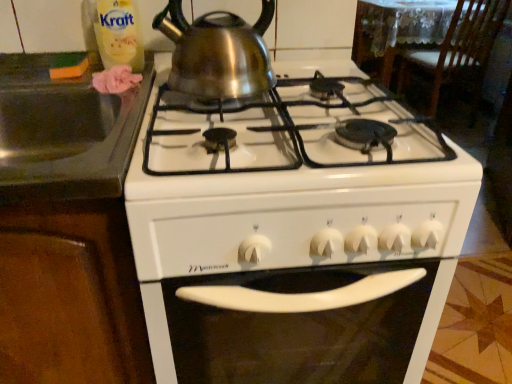
What do you see at coordinates (217, 52) in the screenshot?
I see `shiny metallic kettle at upper center` at bounding box center [217, 52].

I want to click on black granite sink at left, so click(64, 133).

Find the location of a particular element. The height and width of the screenshot is (384, 512). white glossy gas stove at center is located at coordinates (292, 243).

Is shiny metallic kettle at upper center at the back of white glossy gas stove at center?

No.

In the scene shown: From a real-world perspective, is white glossy gas stove at center located beneath shiny metallic kettle at upper center?

Yes.

Looking at this image, can you tell me how much white glossy gas stove at center and shiny metallic kettle at upper center differ in facing direction?

The angle between the facing direction of white glossy gas stove at center and the facing direction of shiny metallic kettle at upper center is 0.000343 degrees.

Which is closer, (216, 277) or (198, 86)?

The point (216, 277) is closer to the camera.

Between shiny metallic kettle at upper center and black granite sink at left, which one has smaller size?

shiny metallic kettle at upper center.

Is shiny metallic kettle at upper center situated inside black granite sink at left or outside?

shiny metallic kettle at upper center lies outside black granite sink at left.

Which is more to the right, shiny metallic kettle at upper center or black granite sink at left?

shiny metallic kettle at upper center.

Could you tell me if shiny metallic kettle at upper center is facing black granite sink at left?

No, shiny metallic kettle at upper center is not oriented towards black granite sink at left.

Looking at this image, could you tell me if wooden chair at upper right is turned towards translucent plastic bottle at upper left?

No.

From a real-world perspective, between wooden chair at upper right and translucent plastic bottle at upper left, who is vertically higher?

translucent plastic bottle at upper left is physically above.

From the image's perspective, does wooden chair at upper right appear higher than translucent plastic bottle at upper left?

Yes, from the image's perspective, wooden chair at upper right is above translucent plastic bottle at upper left.

How many degrees apart are the facing directions of wooden chair at upper right and white glossy gas stove at center?

They differ by 180 degrees in their facing directions.

Which object is more forward, wooden chair at upper right or white glossy gas stove at center?

white glossy gas stove at center is closer to the camera.

Identify the location of gas stove in front of the wooden chair at upper right. The image size is (512, 384). (292, 243).

Would you say wooden chair at upper right is a long distance from white glossy gas stove at center?

Indeed, wooden chair at upper right is not near white glossy gas stove at center.

From a real-world perspective, between black granite sink at left and translucent plastic bottle at upper left, who is vertically lower?

From a 3D spatial view, black granite sink at left is below.

Is black granite sink at left taller than translucent plastic bottle at upper left?

No.

From a real-world perspective, who is located higher, wooden chair at upper right or shiny metallic kettle at upper center?

From a 3D spatial view, shiny metallic kettle at upper center is above.

Consider the image. Which is more to the left, wooden chair at upper right or shiny metallic kettle at upper center?

From the viewer's perspective, shiny metallic kettle at upper center appears more on the left side.

Based on the photo, how different are the orientations of wooden chair at upper right and shiny metallic kettle at upper center in degrees?

There is a 180-degree angle between the facing directions of wooden chair at upper right and shiny metallic kettle at upper center.

Is wooden chair at upper right facing towards shiny metallic kettle at upper center?

No, wooden chair at upper right is not turned towards shiny metallic kettle at upper center.

Is white glossy gas stove at center bigger than wooden chair at upper right?

Yes.

Is white glossy gas stove at center inside the boundaries of wooden chair at upper right, or outside?

white glossy gas stove at center is outside wooden chair at upper right.

You are a GUI agent. You are given a task and a screenshot of the screen. Output one action in this format:
    pyautogui.click(x=<x>, y=<y>)
    Task: Click on the chair above the white glossy gas stove at center (from a real-world perspective)
    The height and width of the screenshot is (384, 512).
    Given the screenshot: What is the action you would take?
    pyautogui.click(x=458, y=51)

From a real-world perspective, is white glossy gas stove at center physically above wooden chair at upper right?

No, from a real-world perspective, white glossy gas stove at center is not on top of wooden chair at upper right.

Where is `gas stove in front of the shiny metallic kettle at upper center`? gas stove in front of the shiny metallic kettle at upper center is located at coordinates (292, 243).

This screenshot has height=384, width=512. In the image, there is a shiny metallic kettle at upper center. In order to click on sink below it (from a real-world perspective) in this screenshot , I will do `click(64, 133)`.

From the image, which object appears to be nearer to white glossy gas stove at center, translucent plastic bottle at upper left or black granite sink at left?

black granite sink at left.

Estimate the real-world distances between objects in this image. Which object is closer to translucent plastic bottle at upper left, black granite sink at left or white glossy gas stove at center?

Based on the image, black granite sink at left appears to be nearer to translucent plastic bottle at upper left.

When comparing their distances from black granite sink at left, does translucent plastic bottle at upper left or wooden chair at upper right seem further?

wooden chair at upper right is further to black granite sink at left.

Considering their positions, is translucent plastic bottle at upper left positioned further to shiny metallic kettle at upper center than black granite sink at left?

black granite sink at left is positioned further to the anchor shiny metallic kettle at upper center.

Estimate the real-world distances between objects in this image. Which object is further from black granite sink at left, white glossy gas stove at center or wooden chair at upper right?

Based on the image, wooden chair at upper right appears to be further to black granite sink at left.

From the picture: Considering their positions, is translucent plastic bottle at upper left positioned closer to shiny metallic kettle at upper center than white glossy gas stove at center?

The object closer to shiny metallic kettle at upper center is translucent plastic bottle at upper left.

Based on their spatial positions, is shiny metallic kettle at upper center or translucent plastic bottle at upper left closer to black granite sink at left?

translucent plastic bottle at upper left is closer to black granite sink at left.

From the image, which object appears to be nearer to translucent plastic bottle at upper left, wooden chair at upper right or black granite sink at left?

The object closer to translucent plastic bottle at upper left is black granite sink at left.

Locate an element on the screen. gas stove located between black granite sink at left and wooden chair at upper right in the depth direction is located at coordinates (292, 243).

In order to click on bottle located between white glossy gas stove at center and wooden chair at upper right in the depth direction in this screenshot , I will do tap(119, 34).

Image resolution: width=512 pixels, height=384 pixels. I want to click on kettle positioned between black granite sink at left and translucent plastic bottle at upper left from near to far, so click(x=217, y=52).

The image size is (512, 384). Find the location of `sink between translucent plastic bottle at upper left and white glossy gas stove at center in the vertical direction`. sink between translucent plastic bottle at upper left and white glossy gas stove at center in the vertical direction is located at coordinates (64, 133).